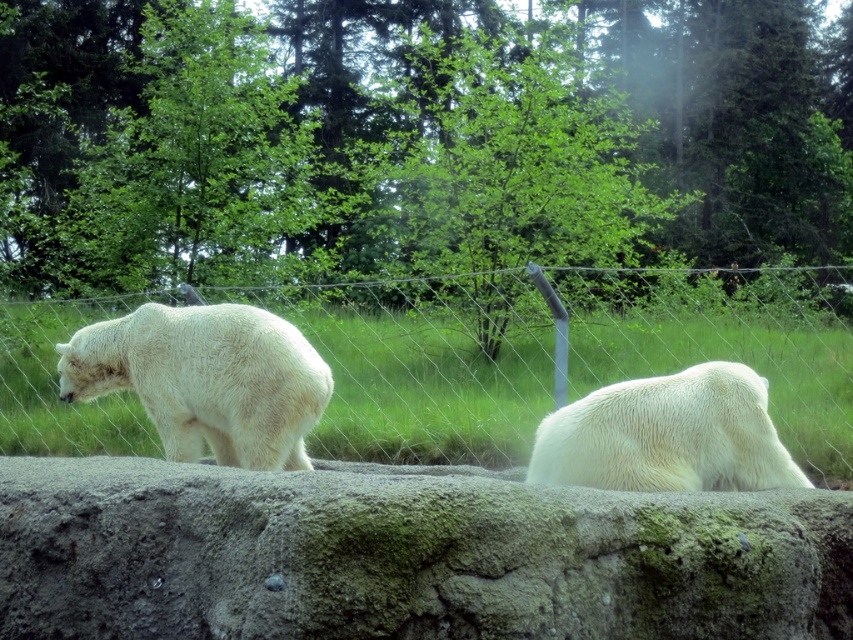
Question: Among these objects, which one is farthest from the camera?

Choices:
 (A) white fluffy bear at right
 (B) white fluffy bear at left
 (C) wire mesh fence at center

Answer: (C)

Question: Is white fluffy bear at left positioned behind white fluffy bear at right?

Choices:
 (A) yes
 (B) no

Answer: (A)

Question: Can you confirm if wire mesh fence at center is positioned below white fluffy bear at right?

Choices:
 (A) no
 (B) yes

Answer: (A)

Question: Considering the relative positions of white fluffy bear at left and white fluffy bear at right in the image provided, where is white fluffy bear at left located with respect to white fluffy bear at right?

Choices:
 (A) left
 (B) right

Answer: (A)

Question: Which of the following is the farthest from the observer?

Choices:
 (A) (250, 420)
 (B) (693, 353)
 (C) (264, 628)
 (D) (627, 433)

Answer: (B)

Question: Which object is farther from the camera taking this photo?

Choices:
 (A) white fluffy bear at left
 (B) wire mesh fence at center
 (C) white fluffy bear at right

Answer: (B)